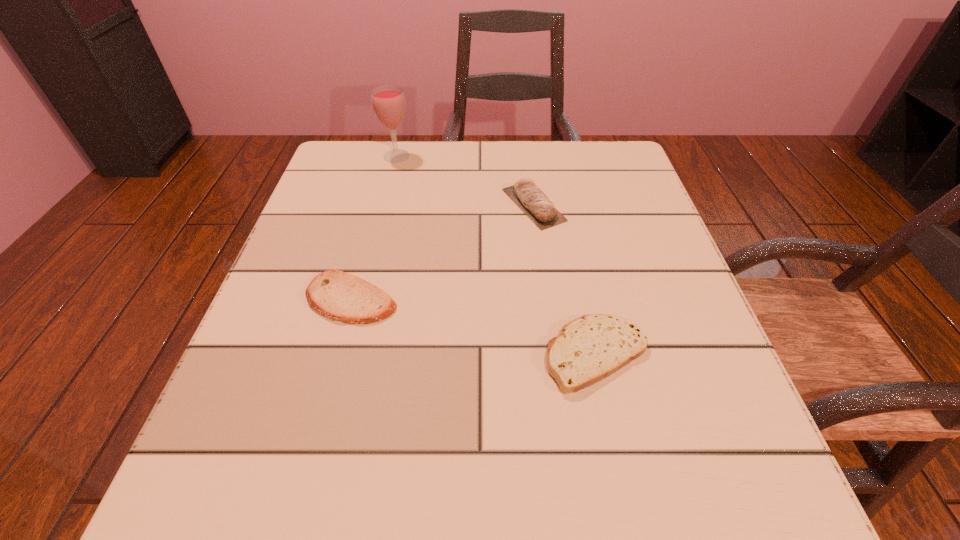
This screenshot has width=960, height=540. In order to click on wineglass in this screenshot , I will do `click(388, 101)`.

Find the location of a particular element. This screenshot has width=960, height=540. the farthest object is located at coordinates (388, 101).

Locate an element on the screen. the third shortest object is located at coordinates (527, 196).

I want to click on the farthest pita bread, so click(x=527, y=196).

Image resolution: width=960 pixels, height=540 pixels. Identify the location of the leftmost pita bread. (339, 296).

Identify the location of free space located 0.290m on the right of the tallest object. (532, 156).

This screenshot has width=960, height=540. Find the location of `free spot located on the left of the second farthest object`. free spot located on the left of the second farthest object is located at coordinates (366, 205).

Where is `vacant space located on the right of the leftmost pita bread`? Image resolution: width=960 pixels, height=540 pixels. vacant space located on the right of the leftmost pita bread is located at coordinates (451, 300).

This screenshot has height=540, width=960. What are the coordinates of `wineglass present at the far edge` in the screenshot? It's located at (388, 101).

At what (x,y) coordinates should I click in order to perform the action: click on pita bread positioned at the far edge. Please return your answer as a coordinate pair (x, y). This screenshot has width=960, height=540. Looking at the image, I should click on (527, 196).